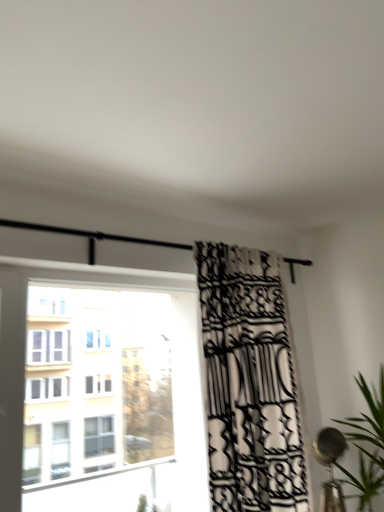
Question: Is transparent glass window at left to the left or to the right of green leafy plant at right in the image?

Choices:
 (A) left
 (B) right

Answer: (A)

Question: From the image's perspective, is transparent glass window at left located above or below green leafy plant at right?

Choices:
 (A) below
 (B) above

Answer: (B)

Question: Estimate the real-world distances between objects in this image. Which object is closer to the transparent glass window at left?

Choices:
 (A) black and white patterned curtain at center
 (B) black curtain at upper center
 (C) green leafy plant at right

Answer: (A)

Question: Estimate the real-world distances between objects in this image. Which object is closer to the black curtain at upper center?

Choices:
 (A) green leafy plant at right
 (B) black and white patterned curtain at center
 (C) transparent glass window at left

Answer: (B)